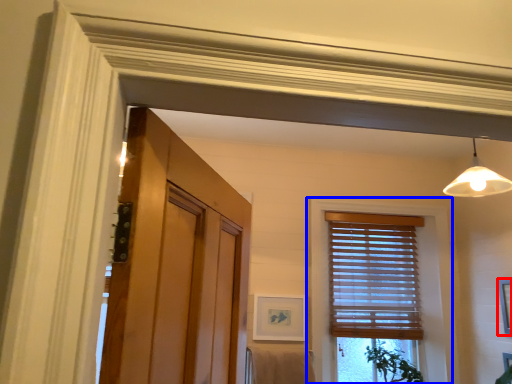
Question: Which point is further to the camera, picture frame (highlighted by a red box) or window (highlighted by a blue box)?

Choices:
 (A) picture frame
 (B) window

Answer: (B)